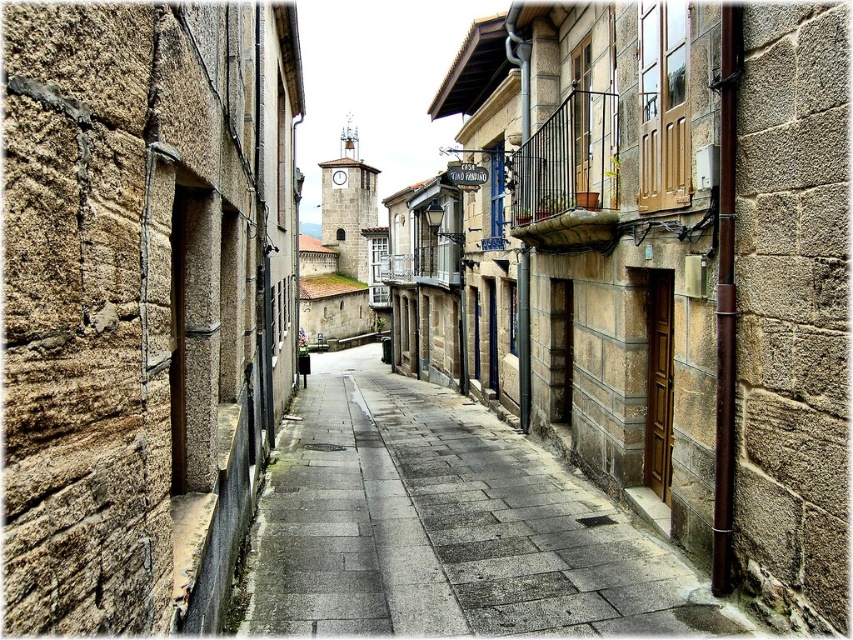
Is rough stone wall at left to the right of gray stone pavement at center from the viewer's perspective?

Incorrect, rough stone wall at left is not on the right side of gray stone pavement at center.

Measure the distance from rough stone wall at left to gray stone pavement at center.

rough stone wall at left is 11.05 feet away from gray stone pavement at center.

Is point (277, 211) less distant than point (604, 628)?

No, it is not.

Where is `rough stone wall at left`? rough stone wall at left is located at coordinates (142, 301).